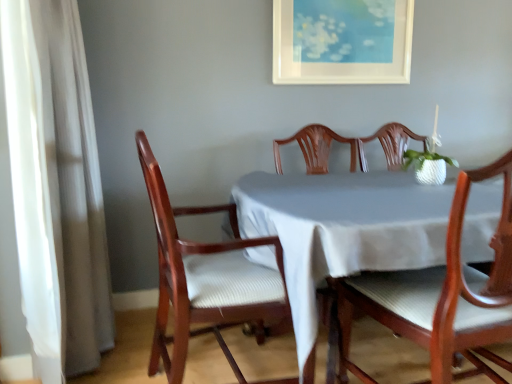
Question: Considering the positions of point (147, 157) and point (458, 211), is point (147, 157) closer or farther from the camera than point (458, 211)?

Choices:
 (A) farther
 (B) closer

Answer: (A)

Question: Is wooden chair at left, placed as the 2th chair when sorted from right to left, bigger or smaller than wooden chair at center, marked as the 1th chair in a right-to-left arrangement?

Choices:
 (A) big
 (B) small

Answer: (A)

Question: Considering the real-world distances, which object is closest to the white matte picture frame at upper center?

Choices:
 (A) wooden chair at left, the 1th chair viewed from the left
 (B) wooden chair at center, the 2th chair when ordered from left to right
 (C) white sheer curtain at left

Answer: (B)

Question: Estimate the real-world distances between objects in this image. Which object is farther from the wooden chair at center, marked as the 1th chair in a right-to-left arrangement?

Choices:
 (A) white matte picture frame at upper center
 (B) white sheer curtain at left
 (C) wooden chair at left, placed as the 2th chair when sorted from right to left

Answer: (A)